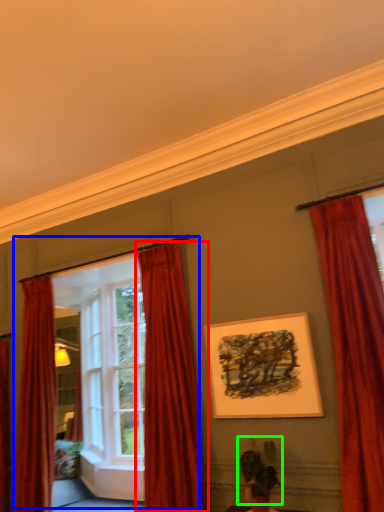
Question: Considering the real-world distances, which object is closest to curtain (highlighted by a red box)? window frame (highlighted by a blue box) or plant (highlighted by a green box).

Choices:
 (A) window frame
 (B) plant

Answer: (A)